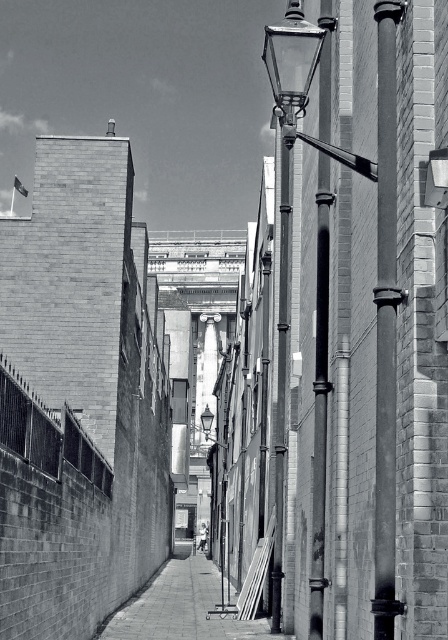
Question: Does smooth concrete pavement at center appear on the left side of smooth metal pole at center?

Choices:
 (A) no
 (B) yes

Answer: (B)

Question: Which object is closer to the camera taking this photo?

Choices:
 (A) smooth metal pole at center right
 (B) smooth metal pole at center
 (C) smooth concrete pavement at center

Answer: (A)

Question: Considering the relative positions of smooth metal pole at center right and smooth concrete pavement at center in the image provided, where is smooth metal pole at center right located with respect to smooth concrete pavement at center?

Choices:
 (A) right
 (B) left

Answer: (A)

Question: Does smooth concrete pavement at center have a larger size compared to smooth metal pole at center?

Choices:
 (A) no
 (B) yes

Answer: (B)

Question: Which object is positioned closest to the smooth metal pole at center right?

Choices:
 (A) smooth concrete pavement at center
 (B) smooth metal pole at center

Answer: (B)

Question: Which object is positioned closest to the smooth metal pole at center?

Choices:
 (A) smooth concrete pavement at center
 (B) smooth metal pole at center right

Answer: (A)